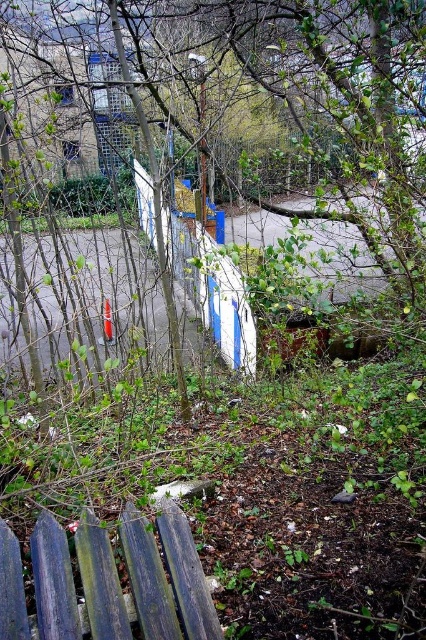
Who is shorter, green leafy tree at center or blue weathered wood at lower left?

blue weathered wood at lower left

Is green leafy tree at center positioned at the back of blue weathered wood at lower left?

Yes, green leafy tree at center is behind blue weathered wood at lower left.

The image size is (426, 640). I want to click on green leafy tree at center, so click(x=282, y=97).